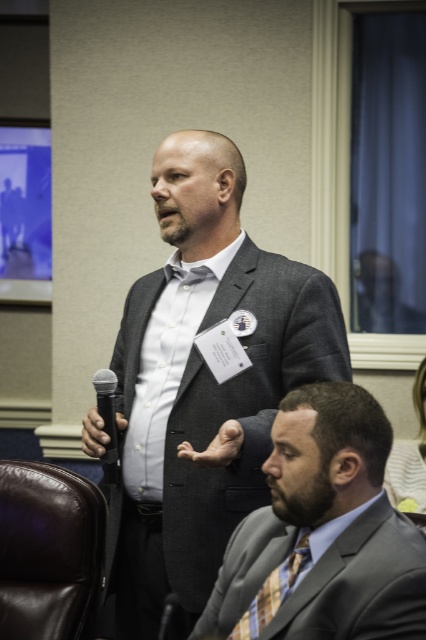
Question: Can you confirm if plaid silk tie at lower center is smaller than black matte microphone at left?

Choices:
 (A) no
 (B) yes

Answer: (B)

Question: Which point is closer to the camera?

Choices:
 (A) plaid silk tie at lower center
 (B) black matte microphone at left
 (C) gray suit at lower right
 (D) brown leather chair at lower left

Answer: (C)

Question: Which object appears closest to the camera in this image?

Choices:
 (A) black matte microphone at left
 (B) matte gray suit at center

Answer: (B)

Question: Does gray suit at lower right have a smaller size compared to brown leather chair at lower left?

Choices:
 (A) no
 (B) yes

Answer: (A)

Question: Which point appears closest to the camera in this image?

Choices:
 (A) (103, 474)
 (B) (39, 513)

Answer: (A)

Question: Does plaid silk tie at lower center come behind black matte microphone at left?

Choices:
 (A) yes
 (B) no

Answer: (B)